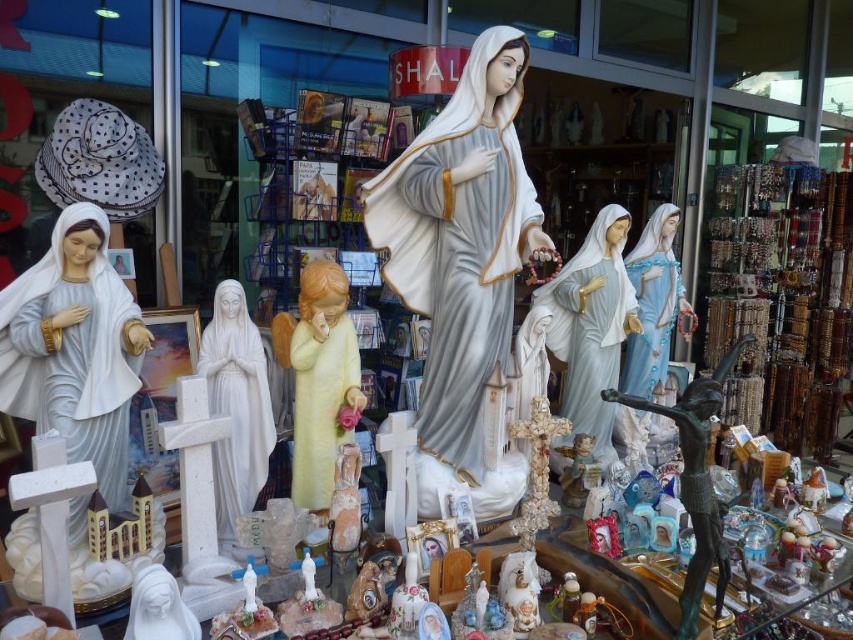
Does point (51, 230) come farther from viewer compared to point (741, 342)?

No, (51, 230) is in front of (741, 342).

Between white porcelain statue at left and bronze statue at lower right, which one is positioned lower?

Positioned lower is bronze statue at lower right.

Where is `white porcelain statue at left`? Image resolution: width=853 pixels, height=640 pixels. white porcelain statue at left is located at coordinates click(74, 348).

Locate an element on the screen. white porcelain statue at left is located at coordinates (74, 348).

Between white porcelain statue at left and white marble statue at center, which one appears on the left side from the viewer's perspective?

white porcelain statue at left is more to the left.

Is point (35, 323) more distant than point (231, 442)?

That is False.

Image resolution: width=853 pixels, height=640 pixels. I want to click on white porcelain statue at left, so click(74, 348).

Does point (309, 371) come closer to viewer compared to point (258, 454)?

Yes.

Is yellow matte angel at center to the right of white marble statue at center from the viewer's perspective?

Yes, yellow matte angel at center is to the right of white marble statue at center.

Between point (311, 410) and point (236, 410), which one is positioned behind?

Point (311, 410)

Locate an element on the screen. The height and width of the screenshot is (640, 853). yellow matte angel at center is located at coordinates (321, 381).